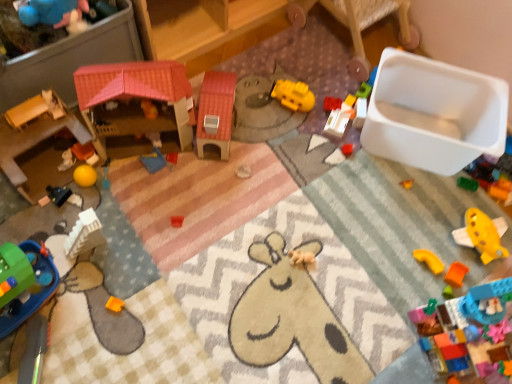
The image size is (512, 384). In order to click on vacant area that lies between smooth wooden dollhouse at left, placed as the 15th toy when sorted from right to left, and translucent blue plastic blocks at lower right, the third toy viewed from the right in this screenshot , I will do `click(260, 258)`.